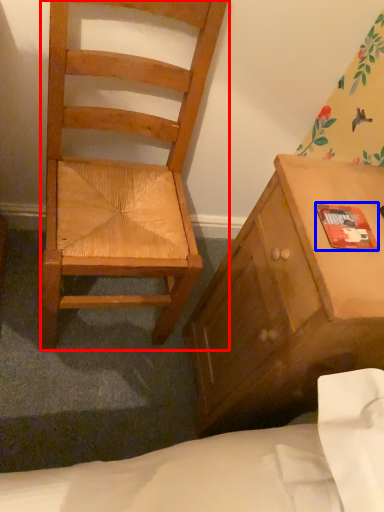
Question: Which of the following is the farthest to the observer, chair (highlighted by a red box) or paperback book (highlighted by a blue box)?

Choices:
 (A) chair
 (B) paperback book

Answer: (B)